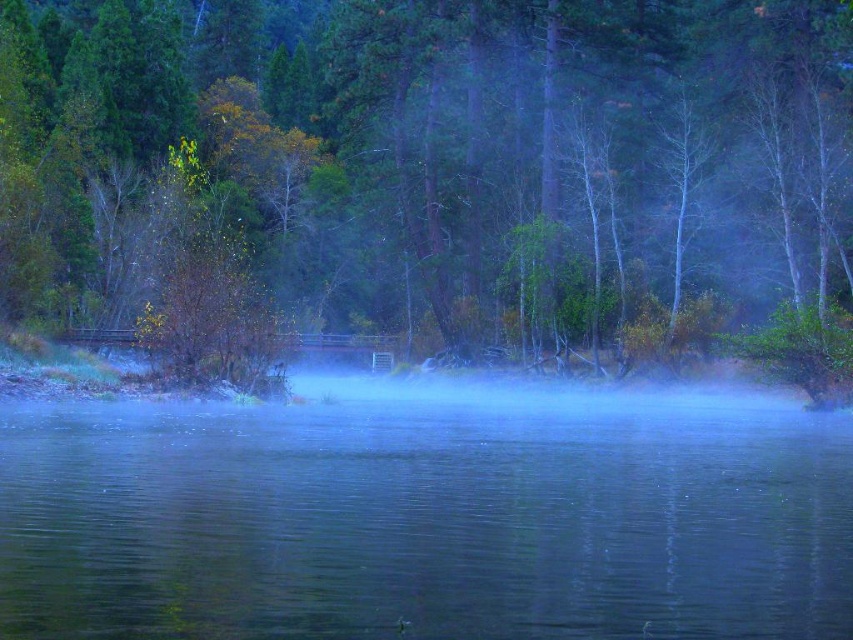
This screenshot has width=853, height=640. I want to click on green matte tree at center, so click(445, 168).

Does green matte tree at center appear over clear water at center?

Indeed, green matte tree at center is positioned over clear water at center.

In order to click on green matte tree at center in this screenshot , I will do `click(445, 168)`.